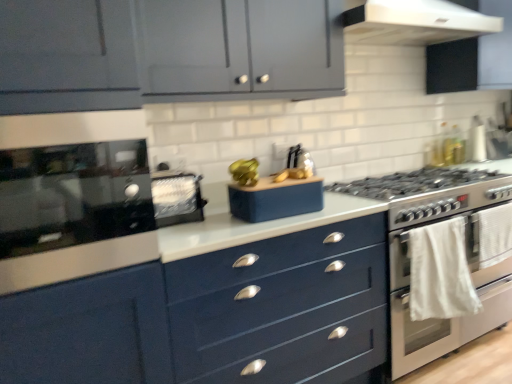
Question: From a real-world perspective, is white fabric towel at right positioned above or below satin black toaster at upper left, which is the 1th appliance in left-to-right order?

Choices:
 (A) above
 (B) below

Answer: (B)

Question: Choose the correct answer: Is white fabric towel at right inside satin black toaster at upper left, the 2th appliance viewed from the right, or outside it?

Choices:
 (A) outside
 (B) inside

Answer: (A)

Question: Which object is the farthest from the glossy black oven at left?

Choices:
 (A) matte blue speaker at center, marked as the 2th appliance in a left-to-right arrangement
 (B) white fabric towel at right
 (C) satin black toaster at upper left, the 2th appliance viewed from the right
 (D) white glossy range hood at upper center
 (E) white glossy oven at right

Answer: (E)

Question: Which object is the farthest from the navy blue drawer at center?

Choices:
 (A) satin black toaster at upper left, which is the 1th appliance in left-to-right order
 (B) matte blue speaker at center, marked as the 1th appliance in a right-to-left arrangement
 (C) white fabric towel at right
 (D) glossy black oven at left
 (E) matte gray cabinets at upper center

Answer: (E)